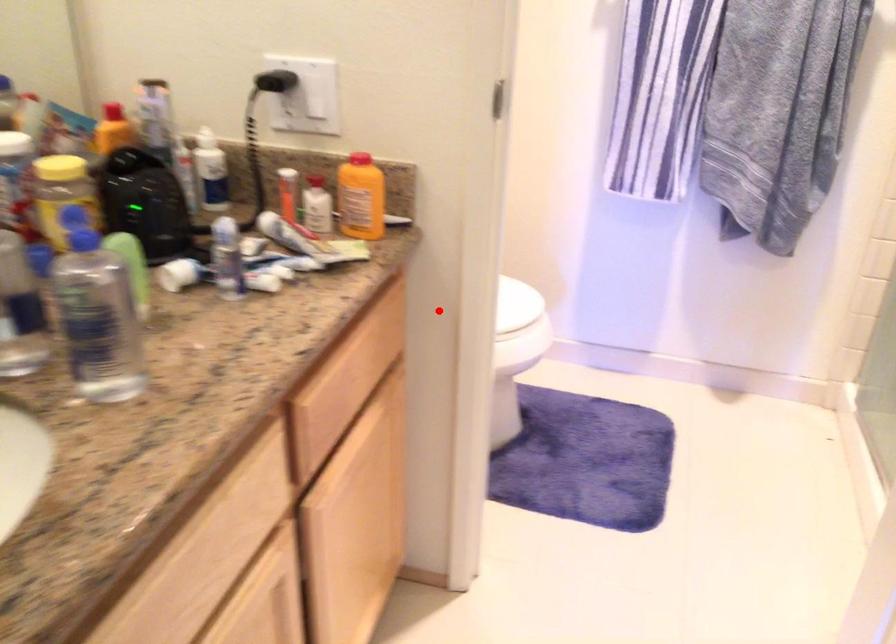
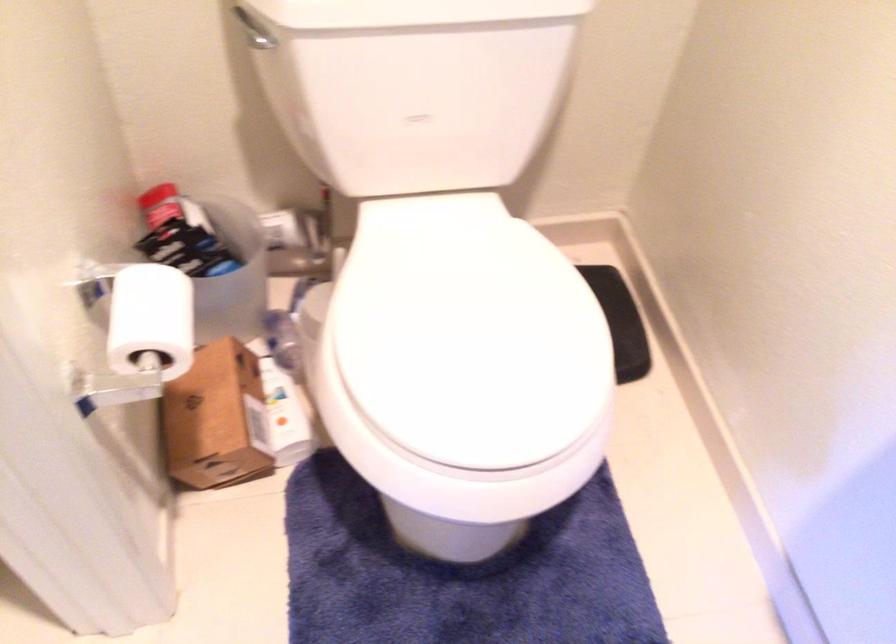
Find the pixel in the second image that matches the highlighted location in the first image.

(151, 319)